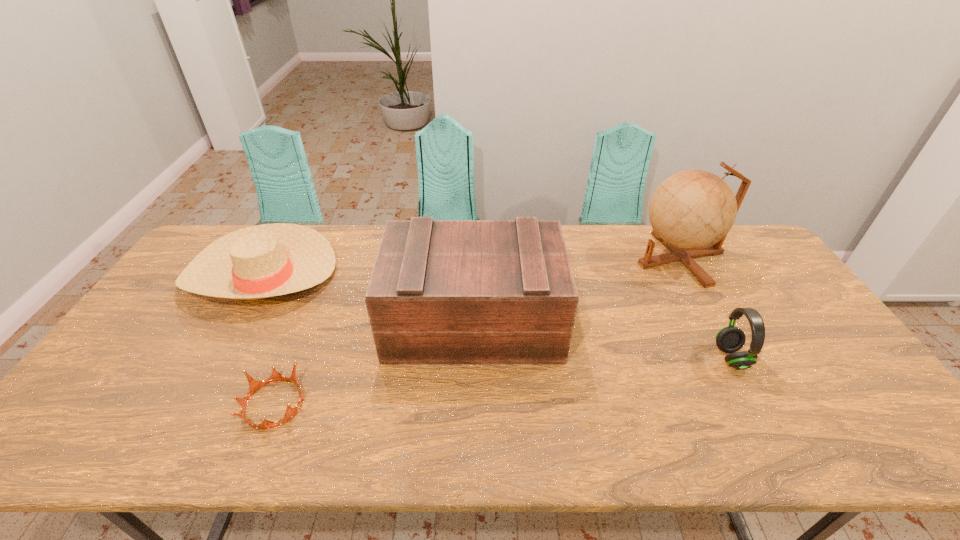
The image size is (960, 540). Identify the location of free point between the crown and the sunhat. (268, 339).

Locate an element on the screen. This screenshot has height=540, width=960. unoccupied position between the box and the headset is located at coordinates (602, 339).

Where is `the closest object to the third object from right to left`? The image size is (960, 540). the closest object to the third object from right to left is located at coordinates (254, 385).

This screenshot has height=540, width=960. What are the coordinates of `object that is the third closest to the globe` in the screenshot? It's located at (267, 260).